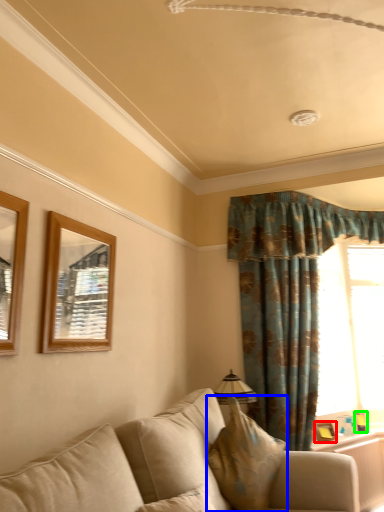
Question: Which is farther away from picture frame (highlighted by a red box)? pillow (highlighted by a blue box) or picture frame (highlighted by a green box)?

Choices:
 (A) pillow
 (B) picture frame

Answer: (A)